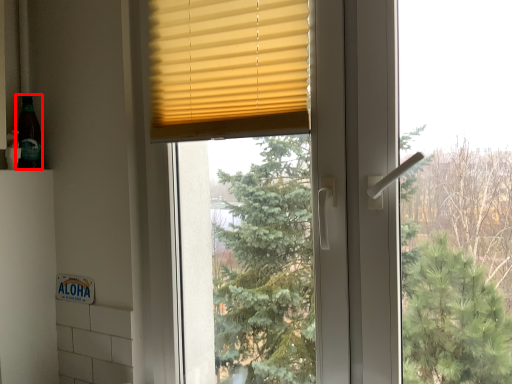
Question: From the image's perspective, considering the relative positions of bottle (annotated by the red box) and window blind in the image provided, where is bottle (annotated by the red box) located with respect to the staircase?

Choices:
 (A) below
 (B) above

Answer: (A)